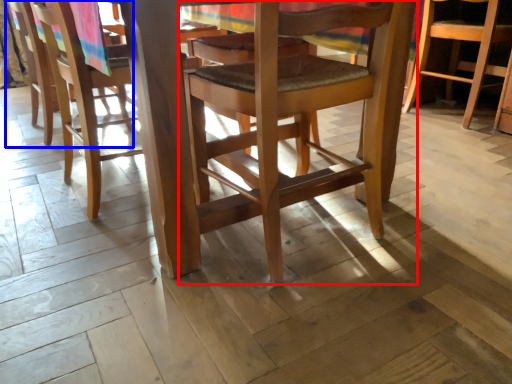
Question: Among these objects, which one is farthest to the camera, chair (highlighted by a red box) or chair (highlighted by a blue box)?

Choices:
 (A) chair
 (B) chair

Answer: (B)